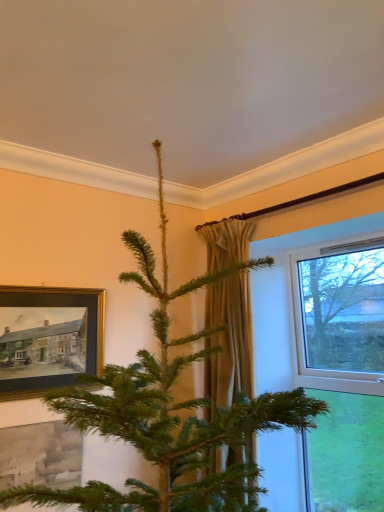
Question: Does clear glass window at right have a greater width compared to beige fabric curtain at center?

Choices:
 (A) yes
 (B) no

Answer: (A)

Question: Does clear glass window at right appear on the right side of beige fabric curtain at center?

Choices:
 (A) no
 (B) yes

Answer: (B)

Question: Is beige fabric curtain at center completely or partially inside clear glass window at right?

Choices:
 (A) no
 (B) yes

Answer: (A)

Question: From a real-world perspective, is clear glass window at right on beige fabric curtain at center?

Choices:
 (A) no
 (B) yes

Answer: (A)

Question: Can you confirm if clear glass window at right is shorter than beige fabric curtain at center?

Choices:
 (A) yes
 (B) no

Answer: (B)

Question: Is gold-framed painting at left wider or thinner than clear glass window at right?

Choices:
 (A) thin
 (B) wide

Answer: (A)

Question: From a real-world perspective, is gold-framed painting at left above or below clear glass window at right?

Choices:
 (A) below
 (B) above

Answer: (B)

Question: Is gold-framed painting at left to the left or to the right of clear glass window at right in the image?

Choices:
 (A) right
 (B) left

Answer: (B)

Question: Is gold-framed painting at left in front of or behind clear glass window at right in the image?

Choices:
 (A) front
 (B) behind

Answer: (B)

Question: From the image's perspective, is clear glass window at right located above or below gold-framed painting at left?

Choices:
 (A) below
 (B) above

Answer: (A)

Question: Is clear glass window at right in front of or behind gold-framed painting at left in the image?

Choices:
 (A) front
 (B) behind

Answer: (A)

Question: Considering the positions of clear glass window at right and gold-framed painting at left in the image, is clear glass window at right taller or shorter than gold-framed painting at left?

Choices:
 (A) short
 (B) tall

Answer: (B)

Question: Is point (339, 453) positioned closer to the camera than point (69, 373)?

Choices:
 (A) closer
 (B) farther

Answer: (B)

Question: Is beige fabric curtain at center wider or thinner than gold-framed painting at left?

Choices:
 (A) wide
 (B) thin

Answer: (A)

Question: From a real-world perspective, is beige fabric curtain at center physically located above or below gold-framed painting at left?

Choices:
 (A) below
 (B) above

Answer: (A)